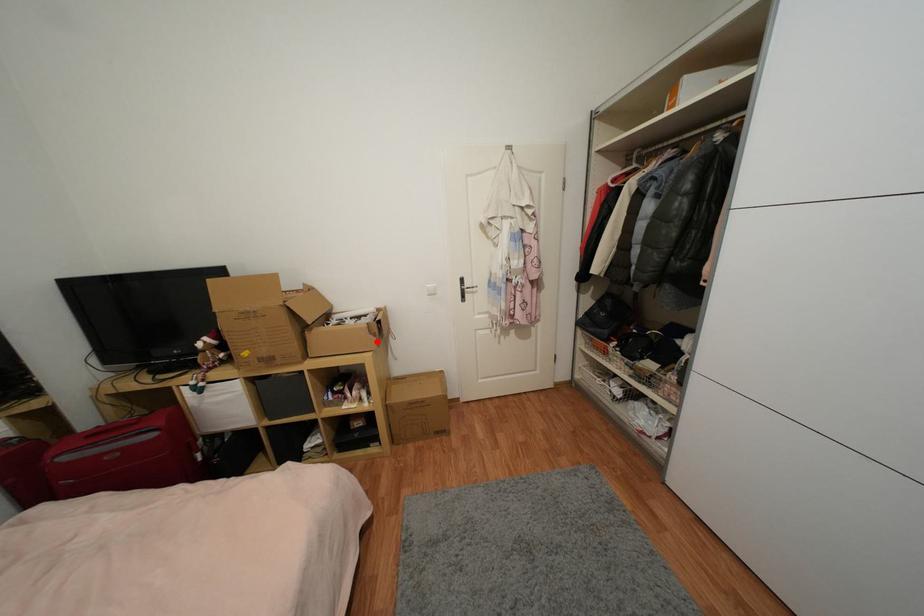
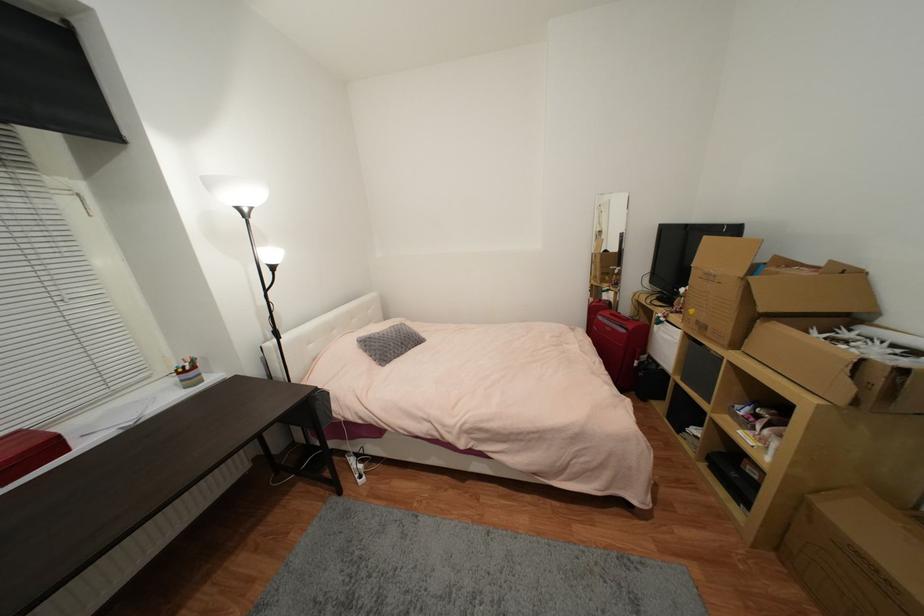
Question: I am providing you with two images of the same scene from different viewpoints. A red point is marked on the first image. Can you still see the location of the red point in image 2?

Choices:
 (A) Yes
 (B) No

Answer: (A)